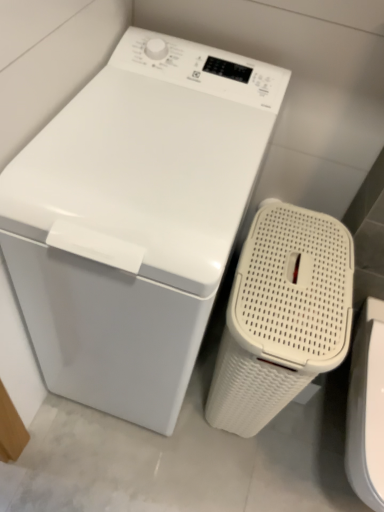
The height and width of the screenshot is (512, 384). What are the coordinates of `white woven laundry basket at right` in the screenshot? It's located at (367, 408).

The width and height of the screenshot is (384, 512). What do you see at coordinates (367, 408) in the screenshot?
I see `white woven laundry basket at right` at bounding box center [367, 408].

You are a GUI agent. You are given a task and a screenshot of the screen. Output one action in this format:
    pyautogui.click(x=<x>, y=<y>)
    Task: Click on the white glossy washing machine at center
    This screenshot has width=384, height=512.
    Given the screenshot: What is the action you would take?
    pyautogui.click(x=135, y=219)

The width and height of the screenshot is (384, 512). What do you see at coordinates (135, 219) in the screenshot?
I see `white glossy washing machine at center` at bounding box center [135, 219].

What is the approximate width of white glossy washing machine at center?

24.75 inches.

Locate an element on the screen. white woven laundry basket at right is located at coordinates (367, 408).

Can you confirm if white woven laundry basket at right is positioned to the right of white glossy washing machine at center?

Indeed, white woven laundry basket at right is positioned on the right side of white glossy washing machine at center.

Considering the relative positions of white woven laundry basket at right and white glossy washing machine at center in the image provided, is white woven laundry basket at right in front of white glossy washing machine at center?

No, the depth of white woven laundry basket at right is greater than that of white glossy washing machine at center.

Considering the points (382, 369) and (147, 159), which point is in front, point (382, 369) or point (147, 159)?

Point (147, 159)

From the image's perspective, is white woven laundry basket at right beneath white glossy washing machine at center?

Correct, white woven laundry basket at right appears lower than white glossy washing machine at center in the image.

From a real-world perspective, which is physically below, white woven laundry basket at right or white glossy washing machine at center?

white woven laundry basket at right is physically lower.

Does white woven laundry basket at right have a lesser width compared to white glossy washing machine at center?

Yes.

Is white woven laundry basket at right shorter than white glossy washing machine at center?

Yes.

Does white woven laundry basket at right have a smaller size compared to white glossy washing machine at center?

Correct, white woven laundry basket at right occupies less space than white glossy washing machine at center.

Is white glossy washing machine at center completely or partially inside white woven laundry basket at right?

No, white glossy washing machine at center is located outside of white woven laundry basket at right.

Would you say white woven laundry basket at right is a long distance from white glossy washing machine at center?

No, white woven laundry basket at right is not far from white glossy washing machine at center.

Is white woven laundry basket at right facing towards white glossy washing machine at center?

No, white woven laundry basket at right is not facing towards white glossy washing machine at center.

What's the angular difference between white woven laundry basket at right and white glossy washing machine at center's facing directions?

They differ by 0.468 degrees in their facing directions.

What are the coordinates of `washer on the right of the white glossy washing machine at center` in the screenshot? It's located at (367, 408).

Is white glossy washing machine at center to the left or to the right of white woven laundry basket at right in the image?

Based on their positions, white glossy washing machine at center is located to the left of white woven laundry basket at right.

Relative to white woven laundry basket at right, is white glossy washing machine at center in front or behind?

white glossy washing machine at center is positioned closer to the viewer than white woven laundry basket at right.

Is point (150, 359) closer or farther from the camera than point (370, 468)?

Point (150, 359) is farther from the camera than point (370, 468).

From the image's perspective, would you say white glossy washing machine at center is shown under white woven laundry basket at right?

No.

From a real-world perspective, which is physically above, white glossy washing machine at center or white woven laundry basket at right?

From a 3D spatial view, white glossy washing machine at center is above.

Considering the sizes of objects white glossy washing machine at center and white woven laundry basket at right in the image provided, who is wider, white glossy washing machine at center or white woven laundry basket at right?

With larger width is white glossy washing machine at center.

Between white glossy washing machine at center and white woven laundry basket at right, which one has less height?

white woven laundry basket at right is shorter.

Can you confirm if white glossy washing machine at center is bigger than white woven laundry basket at right?

Yes, white glossy washing machine at center is bigger than white woven laundry basket at right.

Is white glossy washing machine at center inside the boundaries of white woven laundry basket at right, or outside?

white glossy washing machine at center is located beyond the bounds of white woven laundry basket at right.

Is white glossy washing machine at center far from white woven laundry basket at right?

No.

Is white glossy washing machine at center facing towards white woven laundry basket at right?

No, white glossy washing machine at center is not turned towards white woven laundry basket at right.

Measure the distance from white glossy washing machine at center to white woven laundry basket at right.

white glossy washing machine at center and white woven laundry basket at right are 23.73 inches apart.

Locate an element on the screen. This screenshot has height=512, width=384. washing machine in front of the white woven laundry basket at right is located at coordinates (135, 219).

Identify the location of washing machine above the white woven laundry basket at right (from the image's perspective). The width and height of the screenshot is (384, 512). (135, 219).

At what (x,y) coordinates should I click in order to perform the action: click on washing machine in front of the white woven laundry basket at right. Please return your answer as a coordinate pair (x, y). The width and height of the screenshot is (384, 512). Looking at the image, I should click on (135, 219).